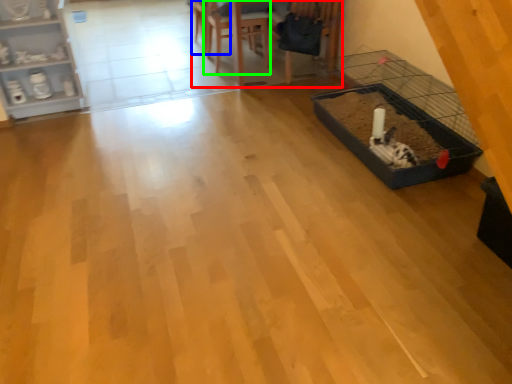
Question: Estimate the real-world distances between objects in this image. Which object is closer to table (highlighted by a red box), armchair (highlighted by a blue box) or armchair (highlighted by a green box)?

Choices:
 (A) armchair
 (B) armchair

Answer: (B)